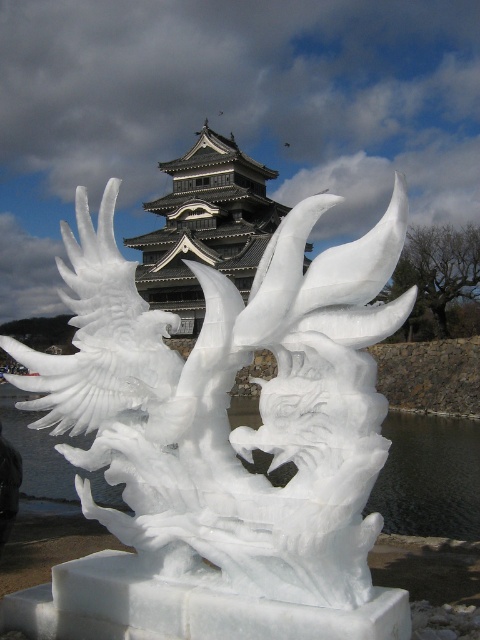
Is white ice sculpture at center in front of dark gray stone tower at center?

That is True.

Is white ice sculpture at center wider than dark gray stone tower at center?

No.

Which is in front, point (351, 593) or point (186, 312)?

Point (351, 593) is in front.

Locate an element on the screen. Image resolution: width=480 pixels, height=640 pixels. white ice sculpture at center is located at coordinates (227, 406).